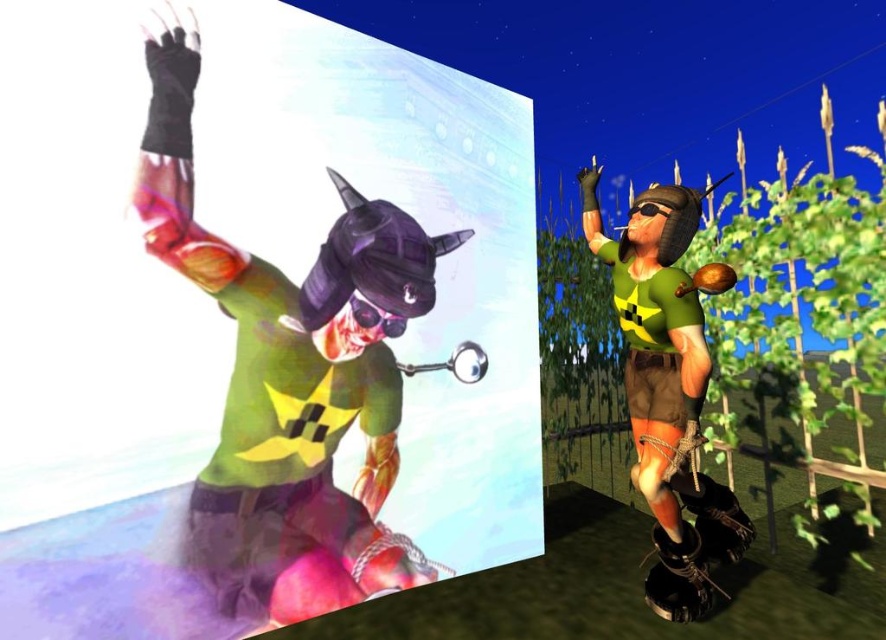
Is matte green t-shirt at upper left shorter than green matte shirt at center?

In fact, matte green t-shirt at upper left may be taller than green matte shirt at center.

Based on the photo, can you confirm if matte green t-shirt at upper left is thinner than green matte shirt at center?

No.

Is point (395, 333) closer to viewer compared to point (673, 232)?

No, it is not.

Where is `matte green t-shirt at upper left`? matte green t-shirt at upper left is located at coordinates (290, 378).